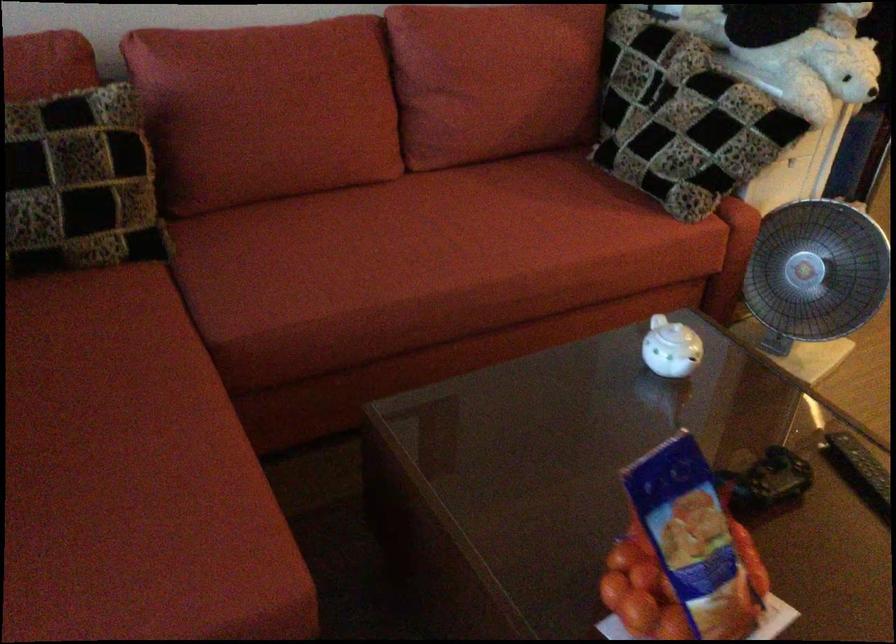
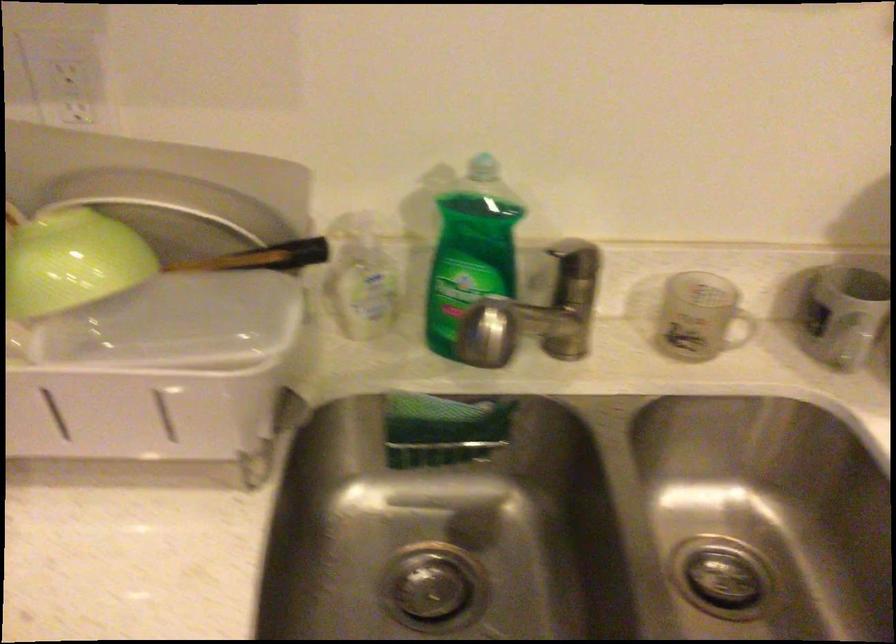
In a continuous first-person perspective shot, in which direction is the camera moving?

The movement direction of the cameraman is right, forward.